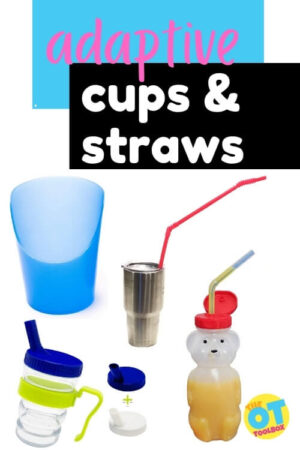
At what (x,y) coordinates should I click in order to perform the action: click on handle. Please return your answer as a coordinate pair (x, y). The image size is (300, 450). Looking at the image, I should click on (99, 401).